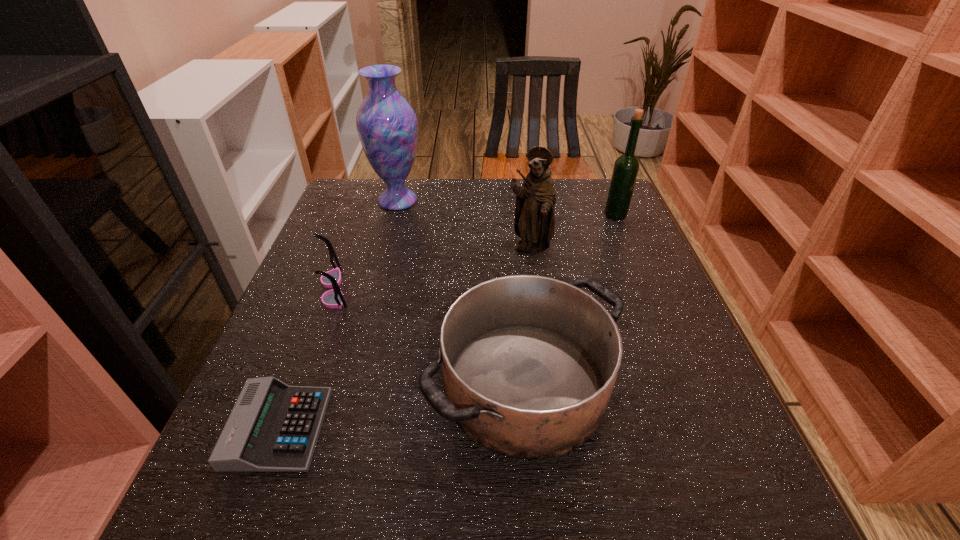
In order to click on blank space that satisfies the following two spatial constraints: 1. on the back side of the fourth farthest object; 2. on the left side of the shortest object in this screenshot , I will do click(x=331, y=289).